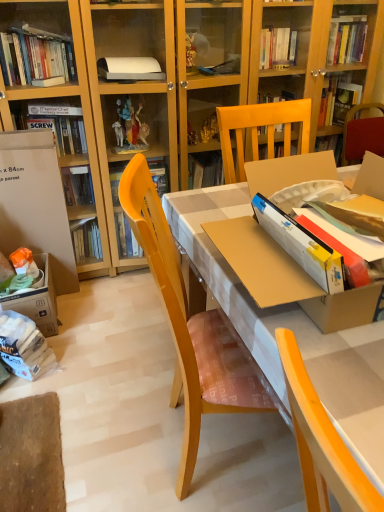
Question: Is white cardboard box at left positioned beyond the bounds of white paper bag at lower left?

Choices:
 (A) yes
 (B) no

Answer: (A)

Question: From the image's perspective, would you say white cardboard box at left is shown under white paper bag at lower left?

Choices:
 (A) yes
 (B) no

Answer: (B)

Question: Is the depth of white cardboard box at left greater than that of white paper bag at lower left?

Choices:
 (A) yes
 (B) no

Answer: (A)

Question: Considering the relative positions of white cardboard box at left and white paper bag at lower left in the image provided, is white cardboard box at left to the left of white paper bag at lower left from the viewer's perspective?

Choices:
 (A) no
 (B) yes

Answer: (B)

Question: From a real-world perspective, is white cardboard box at left below white paper bag at lower left?

Choices:
 (A) no
 (B) yes

Answer: (A)

Question: Are white cardboard box at left and white paper bag at lower left located far from each other?

Choices:
 (A) no
 (B) yes

Answer: (A)

Question: Considering the relative sizes of white paper bag at lower left and matte yellow desk at center in the image provided, is white paper bag at lower left smaller than matte yellow desk at center?

Choices:
 (A) no
 (B) yes

Answer: (B)

Question: Is white paper bag at lower left taller than matte yellow desk at center?

Choices:
 (A) no
 (B) yes

Answer: (A)

Question: Is white paper bag at lower left aimed at matte yellow desk at center?

Choices:
 (A) yes
 (B) no

Answer: (A)

Question: From the image's perspective, is white paper bag at lower left located above matte yellow desk at center?

Choices:
 (A) yes
 (B) no

Answer: (B)

Question: From a real-world perspective, is white paper bag at lower left positioned over matte yellow desk at center based on gravity?

Choices:
 (A) yes
 (B) no

Answer: (B)

Question: Is white paper bag at lower left located outside matte yellow desk at center?

Choices:
 (A) no
 (B) yes

Answer: (B)

Question: Is matte yellow desk at center closer to camera compared to white paper bag at lower left?

Choices:
 (A) yes
 (B) no

Answer: (A)